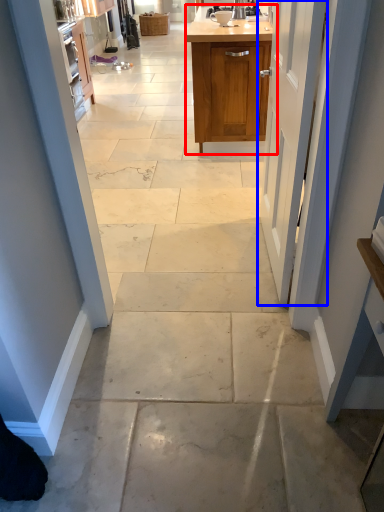
Question: Which object appears farthest to the camera in this image, cabinetry (highlighted by a red box) or door (highlighted by a blue box)?

Choices:
 (A) cabinetry
 (B) door

Answer: (A)